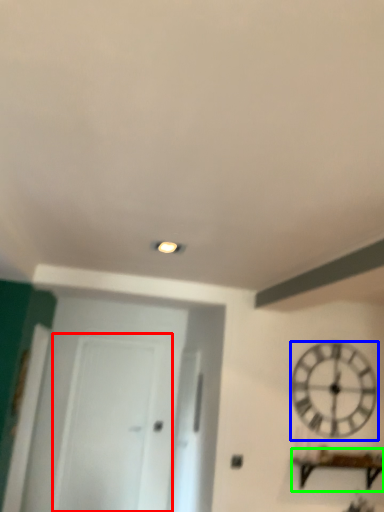
Question: Which object is the closest to the glass door (highlighted by a red box)? Choose among these: wall clock (highlighted by a blue box) or furniture (highlighted by a green box).

Choices:
 (A) wall clock
 (B) furniture

Answer: (A)